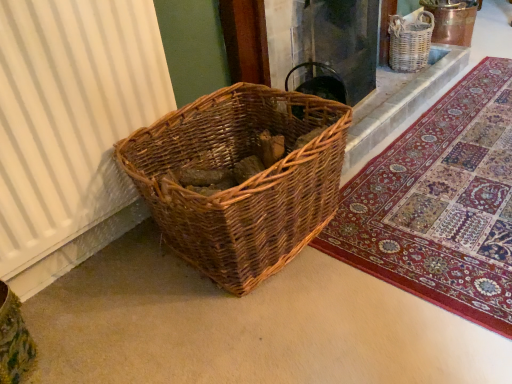
Identify the location of unoccupied area in front of woven wood basket at lower left. (272, 331).